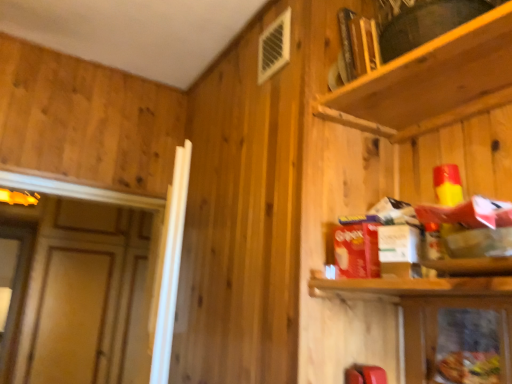
Describe the element at coordinates (458, 339) in the screenshot. The width and height of the screenshot is (512, 384). I see `metallic silver cabinet at lower right` at that location.

Identify the location of metallic silver cabinet at lower right. This screenshot has width=512, height=384. (458, 339).

Describe the element at coordinates (431, 82) in the screenshot. I see `wooden shelf at upper right` at that location.

You are a GUI agent. You are given a task and a screenshot of the screen. Output one action in this format:
    pyautogui.click(x=<x>, y=<y>)
    Task: Click on the wooden shelf at upper right
    The image size is (512, 384).
    Given the screenshot: What is the action you would take?
    pyautogui.click(x=431, y=82)

The image size is (512, 384). What are the coordinates of `metallic silver cabinet at lower right` in the screenshot? It's located at (458, 339).

Can you confirm if wooden shelf at upper right is positioned to the right of metallic silver cabinet at lower right?

No, wooden shelf at upper right is not to the right of metallic silver cabinet at lower right.

Is wooden shelf at upper right in front of or behind metallic silver cabinet at lower right in the image?

Visually, wooden shelf at upper right is located in front of metallic silver cabinet at lower right.

From the picture: Which point is more distant from viewer, (451, 49) or (419, 365)?

Positioned behind is point (419, 365).

From the image's perspective, would you say wooden shelf at upper right is shown under metallic silver cabinet at lower right?

No, from the image's perspective, wooden shelf at upper right is not below metallic silver cabinet at lower right.

From a real-world perspective, does wooden shelf at upper right sit lower than metallic silver cabinet at lower right?

Incorrect, from a real-world perspective, wooden shelf at upper right is higher than metallic silver cabinet at lower right.

Considering the sizes of objects wooden shelf at upper right and metallic silver cabinet at lower right in the image provided, who is thinner, wooden shelf at upper right or metallic silver cabinet at lower right?

Thinner between the two is metallic silver cabinet at lower right.

From the picture: Does wooden shelf at upper right have a lesser height compared to metallic silver cabinet at lower right?

In fact, wooden shelf at upper right may be taller than metallic silver cabinet at lower right.

Considering the sizes of objects wooden shelf at upper right and metallic silver cabinet at lower right in the image provided, who is smaller, wooden shelf at upper right or metallic silver cabinet at lower right?

metallic silver cabinet at lower right.

Would you say wooden shelf at upper right is outside metallic silver cabinet at lower right?

Yes, wooden shelf at upper right is located beyond the bounds of metallic silver cabinet at lower right.

Would you say wooden shelf at upper right is a long distance from metallic silver cabinet at lower right?

Actually, wooden shelf at upper right and metallic silver cabinet at lower right are a little close together.

Is wooden shelf at upper right looking in the opposite direction of metallic silver cabinet at lower right?

No, wooden shelf at upper right is not facing away from metallic silver cabinet at lower right.

What's the angular difference between wooden shelf at upper right and metallic silver cabinet at lower right's facing directions?

The angle between the facing direction of wooden shelf at upper right and the facing direction of metallic silver cabinet at lower right is 5.28 degrees.

Find the location of a particular element. Image resolution: width=512 pixels, height=384 pixels. cabinetry beneath the wooden shelf at upper right (from a real-world perspective) is located at coordinates (458, 339).

Is metallic silver cabinet at lower right at the left side of wooden shelf at upper right?

No, metallic silver cabinet at lower right is not to the left of wooden shelf at upper right.

Does metallic silver cabinet at lower right come in front of wooden shelf at upper right?

No, the depth of metallic silver cabinet at lower right is greater than that of wooden shelf at upper right.

Which is closer, (477,310) or (511,41)?

Clearly, point (477,310) is more distant from the camera than point (511,41).

From the image's perspective, is metallic silver cabinet at lower right under wooden shelf at upper right?

Correct, metallic silver cabinet at lower right appears lower than wooden shelf at upper right in the image.

From a real-world perspective, which object rests below the other?

metallic silver cabinet at lower right is physically lower.

Does metallic silver cabinet at lower right have a greater width compared to wooden shelf at upper right?

In fact, metallic silver cabinet at lower right might be narrower than wooden shelf at upper right.

Considering the sizes of objects metallic silver cabinet at lower right and wooden shelf at upper right in the image provided, who is shorter, metallic silver cabinet at lower right or wooden shelf at upper right?

metallic silver cabinet at lower right.

Does metallic silver cabinet at lower right have a larger size compared to wooden shelf at upper right?

Actually, metallic silver cabinet at lower right might be smaller than wooden shelf at upper right.

Which is correct: metallic silver cabinet at lower right is inside wooden shelf at upper right, or outside of it?

metallic silver cabinet at lower right cannot be found inside wooden shelf at upper right.

Is metallic silver cabinet at lower right next to wooden shelf at upper right and touching it?

There is a gap between metallic silver cabinet at lower right and wooden shelf at upper right.

Is metallic silver cabinet at lower right looking in the opposite direction of wooden shelf at upper right?

No, metallic silver cabinet at lower right is not facing away from wooden shelf at upper right.

Find the location of a particular element. The image size is (512, 384). cabinetry to the right of wooden shelf at upper right is located at coordinates (458, 339).

What are the coordinates of `cabinetry that appears on the right of wooden shelf at upper right` in the screenshot? It's located at tap(458, 339).

Locate an element on the screen. shelf located on the left of metallic silver cabinet at lower right is located at coordinates (431, 82).